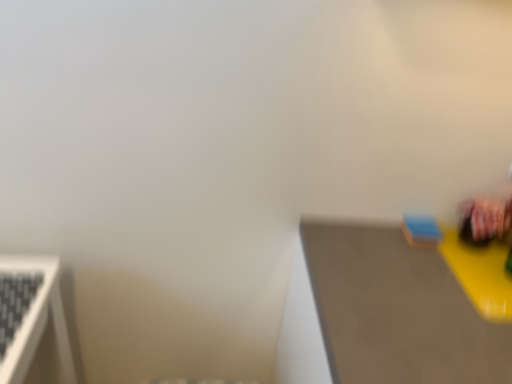
This screenshot has height=384, width=512. What do you see at coordinates (421, 230) in the screenshot? I see `blue matte sponge at upper right, placed as the 2th toy when sorted from right to left` at bounding box center [421, 230].

Describe the element at coordinates (397, 311) in the screenshot. The width and height of the screenshot is (512, 384). I see `smooth gray table at right` at that location.

Locate an element on the screen. This screenshot has height=384, width=512. blue matte sponge at upper right, which is the first toy in left-to-right order is located at coordinates (421, 230).

From the picture: Can you tell me how much blue matte sponge at upper right, which is the first toy in left-to-right order, and matte plastic toy at right, which appears as the 2th toy when viewed from the left, differ in facing direction?

0.0217 degrees.

Can you confirm if blue matte sponge at upper right, which is the first toy in left-to-right order, is taller than matte plastic toy at right, which is counted as the 1th toy, starting from the right?

No, blue matte sponge at upper right, which is the first toy in left-to-right order, is not taller than matte plastic toy at right, which is counted as the 1th toy, starting from the right.

Locate an element on the screen. The image size is (512, 384). toy that is in front of the blue matte sponge at upper right, placed as the 2th toy when sorted from right to left is located at coordinates (484, 220).

Looking at this image, can matte plastic toy at right, which is counted as the 1th toy, starting from the right, be found inside blue matte sponge at upper right, placed as the 2th toy when sorted from right to left?

That's incorrect, matte plastic toy at right, which is counted as the 1th toy, starting from the right, is not inside blue matte sponge at upper right, placed as the 2th toy when sorted from right to left.

Which point is more distant from viewer, (324, 242) or (437, 238)?

The point (437, 238) is farther.

Consider the image. Is smooth gray table at right not within blue matte sponge at upper right, which is the first toy in left-to-right order?

Yes, smooth gray table at right is located beyond the bounds of blue matte sponge at upper right, which is the first toy in left-to-right order.

Does smooth gray table at right appear on the right side of blue matte sponge at upper right, which is the first toy in left-to-right order?

Indeed, smooth gray table at right is positioned on the right side of blue matte sponge at upper right, which is the first toy in left-to-right order.

Consider the image. Can you confirm if smooth gray table at right is shorter than blue matte sponge at upper right, which is the first toy in left-to-right order?

No.

Based on their positions, is matte plastic toy at right, which appears as the 2th toy when viewed from the left, located to the left or right of blue matte sponge at upper right, placed as the 2th toy when sorted from right to left?

Clearly, matte plastic toy at right, which appears as the 2th toy when viewed from the left, is on the right of blue matte sponge at upper right, placed as the 2th toy when sorted from right to left, in the image.

Considering the positions of point (465, 210) and point (433, 243), is point (465, 210) closer or farther from the camera than point (433, 243)?

Point (465, 210) is positioned farther from the camera compared to point (433, 243).

Is matte plastic toy at right, which is counted as the 1th toy, starting from the right, completely or partially outside of blue matte sponge at upper right, placed as the 2th toy when sorted from right to left?

Yes, matte plastic toy at right, which is counted as the 1th toy, starting from the right, is outside of blue matte sponge at upper right, placed as the 2th toy when sorted from right to left.

Is blue matte sponge at upper right, which is the first toy in left-to-right order, closer to the viewer compared to smooth gray table at right?

No.

Is blue matte sponge at upper right, placed as the 2th toy when sorted from right to left, aimed at smooth gray table at right?

No, blue matte sponge at upper right, placed as the 2th toy when sorted from right to left, is not aimed at smooth gray table at right.

From the image's perspective, which one is positioned lower, blue matte sponge at upper right, which is the first toy in left-to-right order, or smooth gray table at right?

smooth gray table at right appears lower in the image.

Is matte plastic toy at right, which appears as the 2th toy when viewed from the left, further to the viewer compared to smooth gray table at right?

Yes, the depth of matte plastic toy at right, which appears as the 2th toy when viewed from the left, is greater than that of smooth gray table at right.

The image size is (512, 384). I want to click on table top below the matte plastic toy at right, which appears as the 2th toy when viewed from the left (from the image's perspective), so click(x=397, y=311).

Based on the photo, from a real-world perspective, is matte plastic toy at right, which is counted as the 1th toy, starting from the right, on smooth gray table at right?

Indeed, from a real-world perspective, matte plastic toy at right, which is counted as the 1th toy, starting from the right, stands above smooth gray table at right.

Which of these two, matte plastic toy at right, which is counted as the 1th toy, starting from the right, or smooth gray table at right, stands shorter?

Standing shorter between the two is matte plastic toy at right, which is counted as the 1th toy, starting from the right.

Is smooth gray table at right facing towards matte plastic toy at right, which is counted as the 1th toy, starting from the right?

No, smooth gray table at right is not aimed at matte plastic toy at right, which is counted as the 1th toy, starting from the right.

In the scene shown: Considering the sizes of objects smooth gray table at right and matte plastic toy at right, which is counted as the 1th toy, starting from the right, in the image provided, who is smaller, smooth gray table at right or matte plastic toy at right, which is counted as the 1th toy, starting from the right,?

matte plastic toy at right, which is counted as the 1th toy, starting from the right.

From a real-world perspective, is smooth gray table at right positioned over matte plastic toy at right, which appears as the 2th toy when viewed from the left, based on gravity?

No, from a real-world perspective, smooth gray table at right is not on top of matte plastic toy at right, which appears as the 2th toy when viewed from the left.

Is there a large distance between smooth gray table at right and matte plastic toy at right, which appears as the 2th toy when viewed from the left?

That's not correct — smooth gray table at right is a little close to matte plastic toy at right, which appears as the 2th toy when viewed from the left.

I want to click on toy above the blue matte sponge at upper right, placed as the 2th toy when sorted from right to left (from a real-world perspective), so click(484, 220).

What are the coordinates of `toy that is on the left side of smooth gray table at right` in the screenshot? It's located at (421, 230).

Looking at the image, which one is located further to smooth gray table at right, blue matte sponge at upper right, which is the first toy in left-to-right order, or matte plastic toy at right, which is counted as the 1th toy, starting from the right?

matte plastic toy at right, which is counted as the 1th toy, starting from the right, is positioned further to the anchor smooth gray table at right.

Considering their positions, is matte plastic toy at right, which is counted as the 1th toy, starting from the right, positioned closer to smooth gray table at right than blue matte sponge at upper right, which is the first toy in left-to-right order?

Among the two, blue matte sponge at upper right, which is the first toy in left-to-right order, is located nearer to smooth gray table at right.

Considering their positions, is smooth gray table at right positioned closer to blue matte sponge at upper right, which is the first toy in left-to-right order, than matte plastic toy at right, which is counted as the 1th toy, starting from the right?

matte plastic toy at right, which is counted as the 1th toy, starting from the right.

When comparing their distances from matte plastic toy at right, which appears as the 2th toy when viewed from the left, does blue matte sponge at upper right, which is the first toy in left-to-right order, or smooth gray table at right seem further?

Among the two, smooth gray table at right is located further to matte plastic toy at right, which appears as the 2th toy when viewed from the left.

When comparing their distances from blue matte sponge at upper right, placed as the 2th toy when sorted from right to left, does matte plastic toy at right, which is counted as the 1th toy, starting from the right, or smooth gray table at right seem closer?

The object closer to blue matte sponge at upper right, placed as the 2th toy when sorted from right to left, is matte plastic toy at right, which is counted as the 1th toy, starting from the right.

Based on their spatial positions, is smooth gray table at right or blue matte sponge at upper right, which is the first toy in left-to-right order, further from matte plastic toy at right, which appears as the 2th toy when viewed from the left?

smooth gray table at right is positioned further to the anchor matte plastic toy at right, which appears as the 2th toy when viewed from the left.

In order to click on toy that lies between matte plastic toy at right, which is counted as the 1th toy, starting from the right, and smooth gray table at right from top to bottom in this screenshot , I will do `click(421, 230)`.